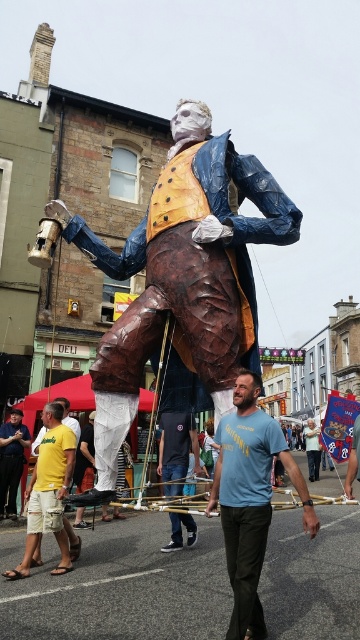
You are a tourist standing in the street scene. You see the bronze statue at center. Where is the bronze statue located relative to the point marked at coordinates [183,276]?

The bronze statue at center is exactly at the point marked at coordinates [183,276].